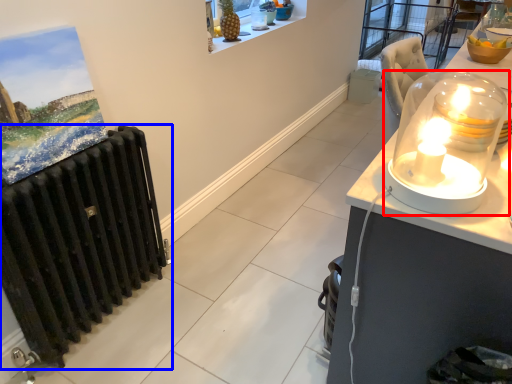
Question: Which of the following is the farthest to the observer, candle holder (highlighted by a red box) or radiator (highlighted by a blue box)?

Choices:
 (A) candle holder
 (B) radiator

Answer: (B)